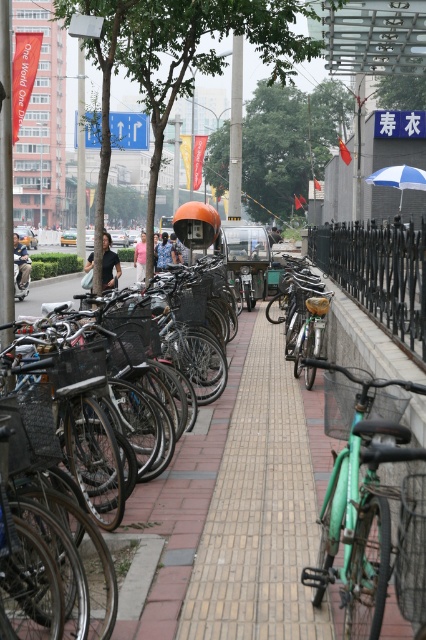
You are a photographer standing in the middle of the urban street scene. You notice two shirts hanging on a clothesline between two poles at the center of the image. The shirts are labeled as the blue printed shirt at center and the pink fabric shirt at center. Which shirt is shorter in height?

The blue printed shirt at center is not as tall as the pink fabric shirt at center, so the blue printed shirt at center is shorter in height.

You are a photographer standing in front of the urban street scene. You want to take a photo that includes both the point at coordinates [265,529] and the point at coordinates [158,262]. Which point should you focus on first to ensure both are in focus?

You should focus on the point at coordinates [265,529] first because it is closer to the camera. Since it is closer, focusing on it will help ensure that the farther point at [158,262] is also within the depth of field and in focus.